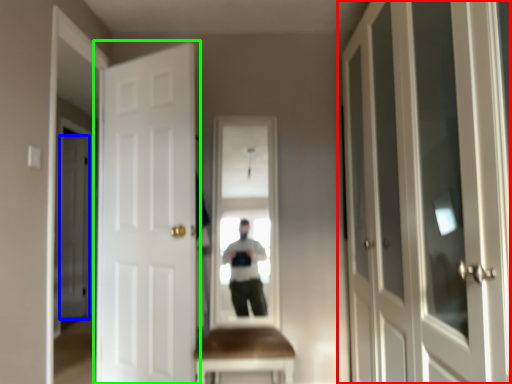
Question: Considering the real-world distances, which object is closest to door (highlighted by a red box)? door (highlighted by a blue box) or door (highlighted by a green box).

Choices:
 (A) door
 (B) door

Answer: (B)